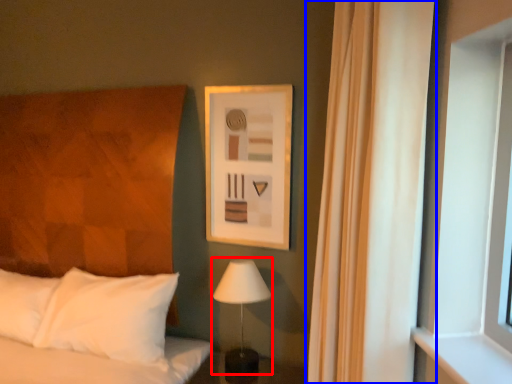
Question: Which point is closer to the camera, table lamp (highlighted by a red box) or curtain (highlighted by a blue box)?

Choices:
 (A) table lamp
 (B) curtain

Answer: (B)